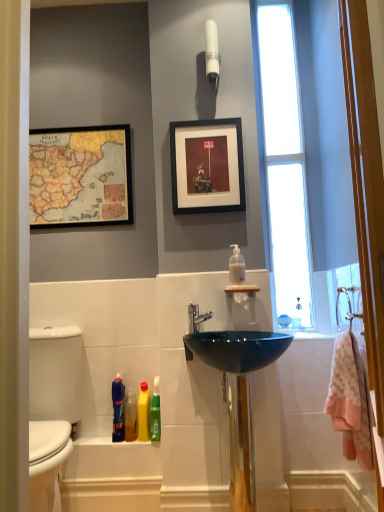
At what (x,y) coordinates should I click in order to perform the action: click on pink cotton bath towel at right. Please return your answer as a coordinate pair (x, y). Image resolution: width=384 pixels, height=512 pixels. Looking at the image, I should click on (350, 400).

What do you see at coordinates (366, 185) in the screenshot? This screenshot has height=512, width=384. I see `pink fabric towel at right` at bounding box center [366, 185].

Find the location of a particular element. green glossy bottle at lower center, which is counted as the 4th cleaning product, starting from the left is located at coordinates (155, 412).

You are a GUI agent. You are given a task and a screenshot of the screen. Output one action in this format:
    pyautogui.click(x=<x>, y=<y>)
    Task: Click on the blue glossy bottle at lower left, acting as the 5th cleaning product starting from the right
    Image resolution: width=384 pixels, height=512 pixels.
    Given the screenshot: What is the action you would take?
    pyautogui.click(x=118, y=409)

Image resolution: width=384 pixels, height=512 pixels. Find the location of `yellow matte bottle at lower center, the 3th cleaning product in the left-to-right sequence`. yellow matte bottle at lower center, the 3th cleaning product in the left-to-right sequence is located at coordinates coord(143,413).

In the scene shown: Would you say yellow matte bottle at lower center, marked as the third cleaning product in a right-to-left arrangement, is a long distance from green glossy bottle at lower center, which is counted as the 4th cleaning product, starting from the left?

No, yellow matte bottle at lower center, marked as the third cleaning product in a right-to-left arrangement, is in close proximity to green glossy bottle at lower center, which is counted as the 4th cleaning product, starting from the left.

From the image's perspective, which object appears higher, yellow matte bottle at lower center, the 3th cleaning product in the left-to-right sequence, or green glossy bottle at lower center, which is the 2th cleaning product in right-to-left order?

green glossy bottle at lower center, which is the 2th cleaning product in right-to-left order.

Identify the location of the 1st cleaning product located beneath the green glossy bottle at lower center, which is the 2th cleaning product in right-to-left order (from a real-world perspective). The image size is (384, 512). pyautogui.click(x=143, y=413).

Considering their positions, is yellow matte bottle at lower center, marked as the third cleaning product in a right-to-left arrangement, located in front of or behind green glossy bottle at lower center, which is the 2th cleaning product in right-to-left order?

In the image, yellow matte bottle at lower center, marked as the third cleaning product in a right-to-left arrangement, appears in front of green glossy bottle at lower center, which is the 2th cleaning product in right-to-left order.

Between white glossy toilet at left and green glossy bottle at lower center, which is the 2th cleaning product in right-to-left order, which one has smaller width?

green glossy bottle at lower center, which is the 2th cleaning product in right-to-left order, is thinner.

From the image's perspective, is white glossy toilet at left below green glossy bottle at lower center, which is counted as the 4th cleaning product, starting from the left?

Yes, from the image's perspective, white glossy toilet at left is beneath green glossy bottle at lower center, which is counted as the 4th cleaning product, starting from the left.

Between white glossy toilet at left and green glossy bottle at lower center, which is counted as the 4th cleaning product, starting from the left, which one is positioned in front?

Positioned in front is white glossy toilet at left.

Is white glossy toilet at left to the left or to the right of green glossy bottle at lower center, which is counted as the 4th cleaning product, starting from the left, in the image?

Based on their positions, white glossy toilet at left is located to the left of green glossy bottle at lower center, which is counted as the 4th cleaning product, starting from the left.

Does green glossy bottle at lower center, which is the 2th cleaning product in right-to-left order, have a larger size compared to satin nickel faucet at center?

Incorrect, green glossy bottle at lower center, which is the 2th cleaning product in right-to-left order, is not larger than satin nickel faucet at center.

From the image's perspective, is green glossy bottle at lower center, which is the 2th cleaning product in right-to-left order, on satin nickel faucet at center?

No, from the image's perspective, green glossy bottle at lower center, which is the 2th cleaning product in right-to-left order, is not above satin nickel faucet at center.

Is there a large distance between white glossy light fixture at upper center and white glossy toilet at left?

Yes, white glossy light fixture at upper center and white glossy toilet at left are quite far apart.

How different are the orientations of white glossy light fixture at upper center and white glossy toilet at left in degrees?

7.41 degrees.

Is white glossy light fixture at upper center positioned beyond the bounds of white glossy toilet at left?

That's correct, white glossy light fixture at upper center is outside of white glossy toilet at left.

Considering the relative sizes of white glossy light fixture at upper center and white glossy toilet at left in the image provided, is white glossy light fixture at upper center taller than white glossy toilet at left?

Incorrect, the height of white glossy light fixture at upper center is not larger of that of white glossy toilet at left.

Does yellow matte bottle at lower center, marked as the third cleaning product in a right-to-left arrangement, turn towards blue glossy bottle at lower left, acting as the 5th cleaning product starting from the right?

No, yellow matte bottle at lower center, marked as the third cleaning product in a right-to-left arrangement, is not turned towards blue glossy bottle at lower left, acting as the 5th cleaning product starting from the right.

Between yellow matte bottle at lower center, the 3th cleaning product in the left-to-right sequence, and blue glossy bottle at lower left, acting as the 5th cleaning product starting from the right, which one is positioned behind?

blue glossy bottle at lower left, acting as the 5th cleaning product starting from the right, is more distant.

Does yellow matte bottle at lower center, marked as the third cleaning product in a right-to-left arrangement, have a greater height compared to blue glossy bottle at lower left, acting as the 5th cleaning product starting from the right?

No, yellow matte bottle at lower center, marked as the third cleaning product in a right-to-left arrangement, is not taller than blue glossy bottle at lower left, acting as the 5th cleaning product starting from the right.

Is yellow matte bottle at lower center, the 3th cleaning product in the left-to-right sequence, far from blue glossy bottle at lower left, acting as the 5th cleaning product starting from the right?

yellow matte bottle at lower center, the 3th cleaning product in the left-to-right sequence, is actually quite close to blue glossy bottle at lower left, acting as the 5th cleaning product starting from the right.

From the image's perspective, which is below, translucent plastic soap dispenser at upper center, marked as the 1th cleaning product in a right-to-left arrangement, or yellow matte bottle at lower center, marked as the third cleaning product in a right-to-left arrangement?

From the image's view, yellow matte bottle at lower center, marked as the third cleaning product in a right-to-left arrangement, is below.

From a real-world perspective, between translucent plastic soap dispenser at upper center, which is the 5th cleaning product in left-to-right order, and yellow matte bottle at lower center, marked as the third cleaning product in a right-to-left arrangement, who is vertically higher?

translucent plastic soap dispenser at upper center, which is the 5th cleaning product in left-to-right order.

Could you tell me if translucent plastic soap dispenser at upper center, which is the 5th cleaning product in left-to-right order, is turned towards yellow matte bottle at lower center, the 3th cleaning product in the left-to-right sequence?

No, translucent plastic soap dispenser at upper center, which is the 5th cleaning product in left-to-right order, is not oriented towards yellow matte bottle at lower center, the 3th cleaning product in the left-to-right sequence.

Measure the distance between translucent plastic soap dispenser at upper center, which is the 5th cleaning product in left-to-right order, and yellow matte bottle at lower center, marked as the third cleaning product in a right-to-left arrangement.

The distance of translucent plastic soap dispenser at upper center, which is the 5th cleaning product in left-to-right order, from yellow matte bottle at lower center, marked as the third cleaning product in a right-to-left arrangement, is 30.18 inches.

From the image's perspective, which one is positioned higher, white glossy toilet at left or glossy glass sink at center?

glossy glass sink at center is shown above in the image.

Looking at this image, is white glossy toilet at left oriented towards glossy glass sink at center?

No, white glossy toilet at left does not turn towards glossy glass sink at center.

From a real-world perspective, is white glossy toilet at left above or below glossy glass sink at center?

white glossy toilet at left is below glossy glass sink at center.

Which point is more forward, (53, 413) or (243, 434)?

The point (243, 434) is closer.

Which cleaning product is the 2nd one when counting from the back of the yellow matte bottle at lower center, marked as the third cleaning product in a right-to-left arrangement? Please provide its 2D coordinates.

[(155, 412)]

From the image's perspective, count 3rd cleaning products upward from the white glossy toilet at left and point to it. Please provide its 2D coordinates.

[(155, 412)]

When comparing their distances from translucent plastic soap dispenser at upper center, which is the 5th cleaning product in left-to-right order, does glossy glass sink at center or pink cotton bath towel at right seem further?

Among the two, pink cotton bath towel at right is located further to translucent plastic soap dispenser at upper center, which is the 5th cleaning product in left-to-right order.

From the image, which object appears to be nearer to glossy glass sink at center, white glossy toilet at left or pink fabric towel at right?

Among the two, white glossy toilet at left is located nearer to glossy glass sink at center.

Based on their spatial positions, is blue glossy bottle at lower left, acting as the 5th cleaning product starting from the right, or satin nickel faucet at center further from transparent glass window at upper right?

blue glossy bottle at lower left, acting as the 5th cleaning product starting from the right.

From the image, which object appears to be farther from translucent plastic bottle at lower center, the fourth cleaning product in the right-to-left sequence, pink cotton bath towel at right or transparent glass window at upper right?

transparent glass window at upper right.

Which object lies further to the anchor point translucent plastic bottle at lower center, acting as the 2th cleaning product starting from the left, wooden map at upper left, which is counted as the first picture frame, starting from the back, or black matte picture frame at upper center, the second picture frame in the back-to-front sequence?

Based on the image, black matte picture frame at upper center, the second picture frame in the back-to-front sequence, appears to be further to translucent plastic bottle at lower center, acting as the 2th cleaning product starting from the left.

From the image, which object appears to be nearer to pink fabric towel at right, black matte picture frame at upper center, the second picture frame in the back-to-front sequence, or white glossy toilet at left?

black matte picture frame at upper center, the second picture frame in the back-to-front sequence, lies closer to pink fabric towel at right than the other object.

Based on their spatial positions, is white glossy toilet at left or yellow matte bottle at lower center, marked as the third cleaning product in a right-to-left arrangement, further from glossy glass sink at center?

white glossy toilet at left is positioned further to the anchor glossy glass sink at center.

Based on their spatial positions, is translucent plastic soap dispenser at upper center, marked as the 1th cleaning product in a right-to-left arrangement, or satin nickel faucet at center closer to pink cotton bath towel at right?

Among the two, translucent plastic soap dispenser at upper center, marked as the 1th cleaning product in a right-to-left arrangement, is located nearer to pink cotton bath towel at right.

Find the location of a particular element. tap between wooden map at upper left, which is counted as the first picture frame, starting from the back, and white glossy toilet at left in the up-down direction is located at coordinates click(x=196, y=318).

The image size is (384, 512). In order to click on sink positioned between pink fabric towel at right and green glossy bottle at lower center, which is the 2th cleaning product in right-to-left order, from near to far in this screenshot , I will do `click(238, 395)`.

At what (x,y) coordinates should I click in order to perform the action: click on bath towel between black matte picture frame at upper center, marked as the first picture frame in a front-to-back arrangement, and blue glossy bottle at lower left, acting as the 5th cleaning product starting from the right, in the vertical direction. Please return your answer as a coordinate pair (x, y). Looking at the image, I should click on (350, 400).

You are a GUI agent. You are given a task and a screenshot of the screen. Output one action in this format:
    pyautogui.click(x=<x>, y=<y>)
    Task: Click on the gray between pink fabric towel at right and wooden map at upper left, which appears as the 1th picture frame when viewed from the left, in the front-back direction
    The image size is (384, 512).
    Given the screenshot: What is the action you would take?
    pyautogui.click(x=52, y=408)